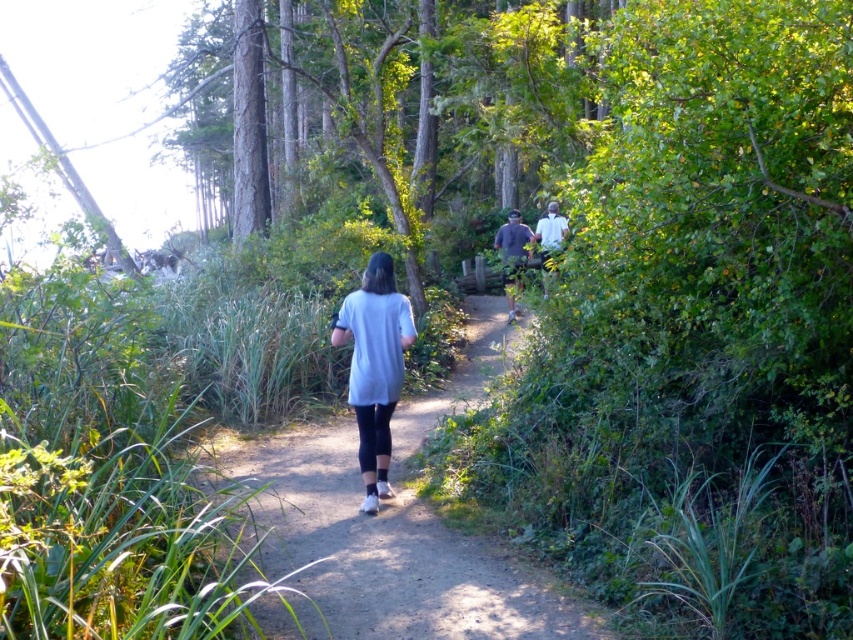
Can you confirm if gray fabric shirt at center is smaller than dark gray shirt at center?

No.

Can you confirm if gray fabric shirt at center is thinner than dark gray shirt at center?

No, gray fabric shirt at center is not thinner than dark gray shirt at center.

The image size is (853, 640). Identify the location of gray fabric shirt at center. (397, 525).

Where is `gray fabric shirt at center`? gray fabric shirt at center is located at coordinates (397, 525).

Is point (389, 330) closer to camera compared to point (563, 220)?

Yes, it is.

Measure the distance between white matte shirt at center and camera.

white matte shirt at center and camera are 7.10 meters apart.

Between point (350, 296) and point (543, 241), which one is positioned behind?

The point (543, 241) is more distant.

This screenshot has width=853, height=640. Identify the location of white matte shirt at center. (374, 365).

The image size is (853, 640). Identify the location of gray fabric shirt at center. (397, 525).

Find the location of a particular element. gray fabric shirt at center is located at coordinates (397, 525).